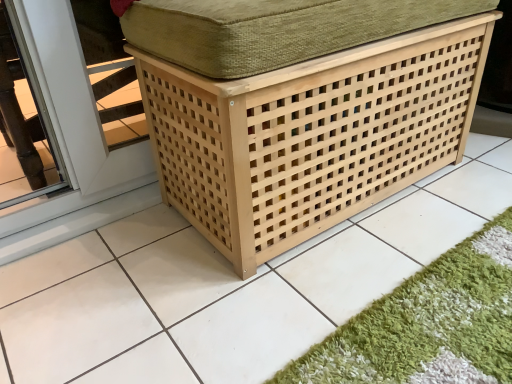
Question: Is green shaggy bath mat at lower right closer to camera compared to natural wood lattice storage box at center?

Choices:
 (A) yes
 (B) no

Answer: (A)

Question: Is green shaggy bath mat at lower right at the right side of natural wood lattice storage box at center?

Choices:
 (A) no
 (B) yes

Answer: (B)

Question: Is green shaggy bath mat at lower right directly adjacent to natural wood lattice storage box at center?

Choices:
 (A) no
 (B) yes

Answer: (A)

Question: Considering the relative sizes of green shaggy bath mat at lower right and natural wood lattice storage box at center in the image provided, is green shaggy bath mat at lower right smaller than natural wood lattice storage box at center?

Choices:
 (A) yes
 (B) no

Answer: (A)

Question: Can you confirm if green shaggy bath mat at lower right is thinner than natural wood lattice storage box at center?

Choices:
 (A) yes
 (B) no

Answer: (A)

Question: Is green shaggy bath mat at lower right facing towards natural wood lattice storage box at center?

Choices:
 (A) no
 (B) yes

Answer: (B)

Question: Does natural wood lattice storage box at center have a greater width compared to green shaggy bath mat at lower right?

Choices:
 (A) no
 (B) yes

Answer: (B)

Question: Can you confirm if natural wood lattice storage box at center is taller than green shaggy bath mat at lower right?

Choices:
 (A) yes
 (B) no

Answer: (A)

Question: Is natural wood lattice storage box at center closer to the viewer compared to green shaggy bath mat at lower right?

Choices:
 (A) yes
 (B) no

Answer: (B)

Question: Is natural wood lattice storage box at center at the right side of green shaggy bath mat at lower right?

Choices:
 (A) yes
 (B) no

Answer: (B)

Question: Is natural wood lattice storage box at center completely or partially outside of green shaggy bath mat at lower right?

Choices:
 (A) no
 (B) yes

Answer: (B)

Question: Is natural wood lattice storage box at center not close to green shaggy bath mat at lower right?

Choices:
 (A) yes
 (B) no

Answer: (B)

Question: Considering the positions of point (296, 96) and point (485, 291), is point (296, 96) closer or farther from the camera than point (485, 291)?

Choices:
 (A) farther
 (B) closer

Answer: (B)